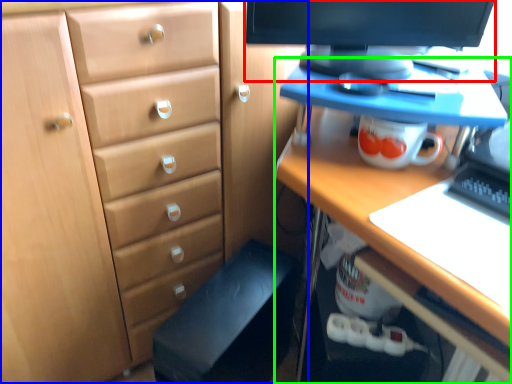
Question: Estimate the real-world distances between objects in this image. Which object is farther from computer monitor (highlighted by a red box), chest of drawers (highlighted by a blue box) or desk (highlighted by a green box)?

Choices:
 (A) chest of drawers
 (B) desk

Answer: (A)